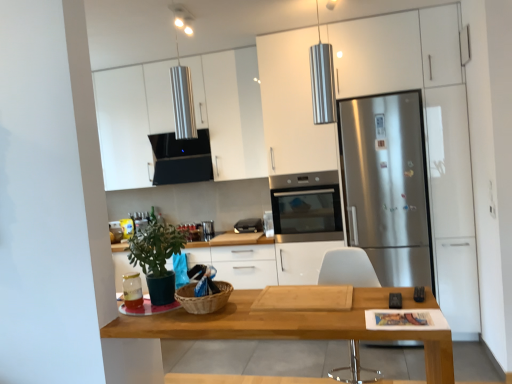
Identify the location of free point in front of woven brown basket at center. Image resolution: width=512 pixels, height=384 pixels. (215, 319).